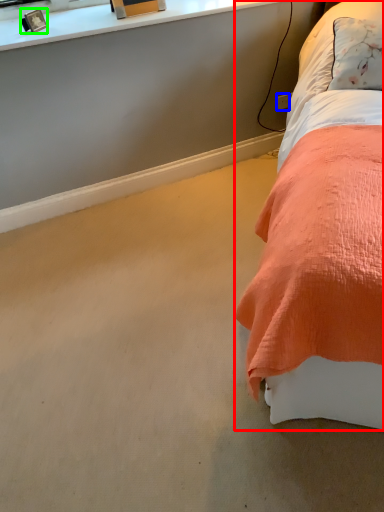
Question: Considering the real-world distances, which object is closest to bed (highlighted by a red box)? power outlet (highlighted by a blue box) or picture frame (highlighted by a green box).

Choices:
 (A) power outlet
 (B) picture frame

Answer: (A)